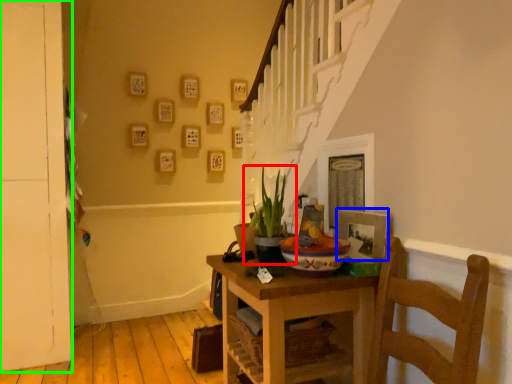
Question: Estimate the real-world distances between objects in this image. Which object is closer to houseplant (highlighted by a red box), picture frame (highlighted by a blue box) or door (highlighted by a green box)?

Choices:
 (A) picture frame
 (B) door

Answer: (A)